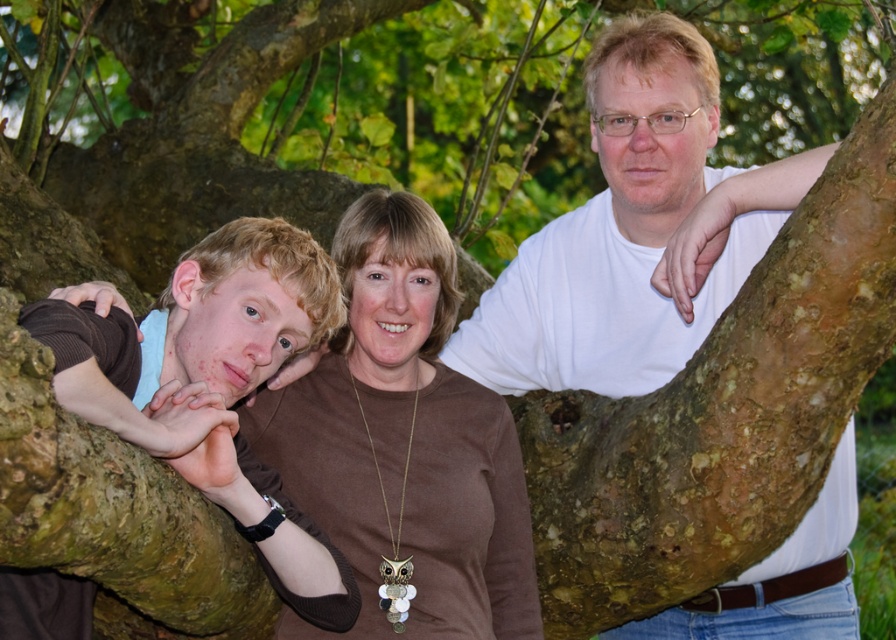
You are a photographer trying to focus on both the white matte shirt at upper center and the brown matte necklace at center in the image. Since the camera can only focus on one object at a time, which object should you choose to ensure the larger one is in focus?

The white matte shirt at upper center is larger in size than the brown matte necklace at center, so you should focus on the white matte shirt at upper center to ensure the larger object is in focus.